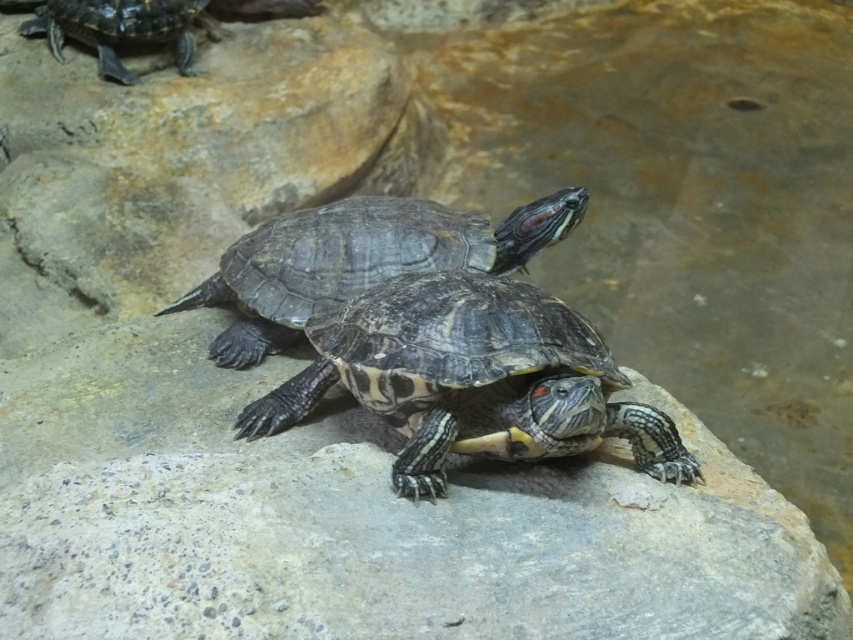
Question: Where is patterned shell turtle at center located in relation to shiny dark brown tortoise at center in the image?

Choices:
 (A) left
 (B) right

Answer: (B)

Question: Considering the relative positions of patterned shell turtle at center and shiny dark brown tortoise at center in the image provided, where is patterned shell turtle at center located with respect to shiny dark brown tortoise at center?

Choices:
 (A) right
 (B) left

Answer: (A)

Question: Which object is positioned closest to the shiny dark brown tortoise at center?

Choices:
 (A) patterned shell turtle at center
 (B) shiny black tortoise at upper left

Answer: (A)

Question: Does patterned shell turtle at center have a lesser width compared to shiny dark brown tortoise at center?

Choices:
 (A) yes
 (B) no

Answer: (A)

Question: Which object is positioned closest to the patterned shell turtle at center?

Choices:
 (A) shiny dark brown tortoise at center
 (B) shiny black tortoise at upper left

Answer: (A)

Question: Which of these objects is positioned closest to the shiny black tortoise at upper left?

Choices:
 (A) shiny dark brown tortoise at center
 (B) patterned shell turtle at center

Answer: (A)